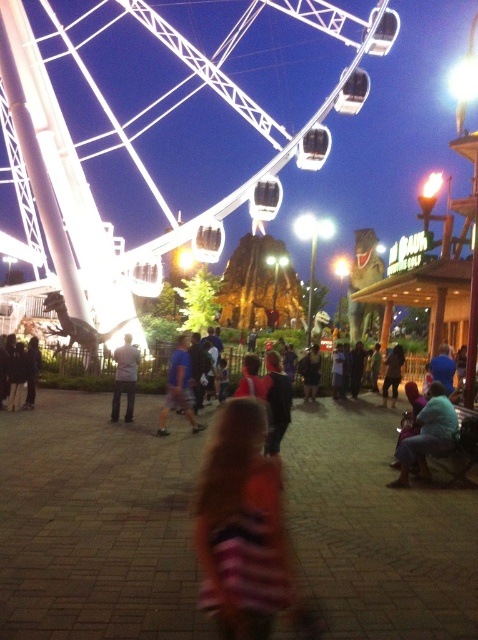
Is point (225, 77) positioned after point (123, 360)?

Yes, point (225, 77) is farther from viewer.

Between point (263, 109) and point (121, 371), which one is positioned in front?

Point (121, 371) is in front.

Does point (142, 266) come farther from viewer compared to point (122, 365)?

Yes, point (142, 266) is farther from viewer.

Identify the location of white metallic ferris wheel at upper left. (248, 115).

Does blue denim jeans at lower right appear over striped shirt at center?

No.

Can you confirm if blue denim jeans at lower right is smaller than striped shirt at center?

Yes.

Which is in front, point (456, 429) or point (307, 388)?

Point (456, 429) is more forward.

Identify the location of blue denim jeans at lower right. This screenshot has height=640, width=478. pyautogui.click(x=426, y=436).

Looking at this image, which of these two, striped fabric dress at center or blue denim jeans at lower right, stands taller?

With more height is striped fabric dress at center.

Is point (235, 435) positioned after point (423, 412)?

No, it is not.

I want to click on striped fabric dress at center, so click(x=241, y=525).